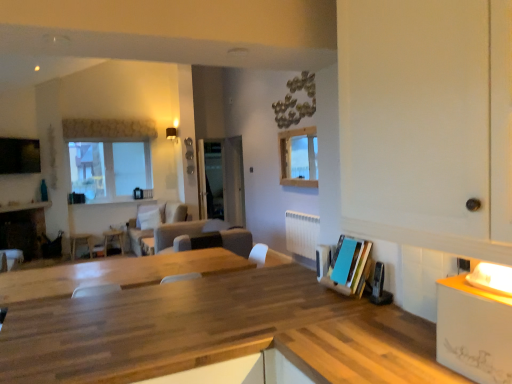
Question: Does suede beige couch at center, arranged as the second couch when viewed from the front, have a lesser height compared to suede-like gray couch at center, which appears as the second couch when viewed from the back?

Choices:
 (A) yes
 (B) no

Answer: (B)

Question: Is suede beige couch at center, the 1th couch from the back, in front of suede-like gray couch at center, arranged as the first couch when viewed from the front?

Choices:
 (A) yes
 (B) no

Answer: (B)

Question: Is suede beige couch at center, the 1th couch from the back, positioned with its back to suede-like gray couch at center, arranged as the first couch when viewed from the front?

Choices:
 (A) yes
 (B) no

Answer: (B)

Question: Can you see suede beige couch at center, arranged as the second couch when viewed from the front, touching suede-like gray couch at center, which appears as the second couch when viewed from the back?

Choices:
 (A) yes
 (B) no

Answer: (B)

Question: Considering the relative sizes of suede beige couch at center, the 1th couch from the back, and suede-like gray couch at center, arranged as the first couch when viewed from the front, in the image provided, is suede beige couch at center, the 1th couch from the back, wider than suede-like gray couch at center, arranged as the first couch when viewed from the front,?

Choices:
 (A) no
 (B) yes

Answer: (A)

Question: Is transparent glass door at center taller or shorter than white glossy counter at right?

Choices:
 (A) tall
 (B) short

Answer: (A)

Question: Based on their positions, is transparent glass door at center located to the left or right of white glossy counter at right?

Choices:
 (A) left
 (B) right

Answer: (A)

Question: In the image, is transparent glass door at center positioned in front of or behind white glossy counter at right?

Choices:
 (A) behind
 (B) front

Answer: (A)

Question: Would you say transparent glass door at center is inside or outside white glossy counter at right?

Choices:
 (A) inside
 (B) outside

Answer: (B)

Question: Is clear glass window at upper center, the second window from the back, bigger or smaller than suede-like gray couch at center, arranged as the first couch when viewed from the front?

Choices:
 (A) small
 (B) big

Answer: (A)

Question: Does point (282, 145) appear closer or farther from the camera than point (192, 221)?

Choices:
 (A) closer
 (B) farther

Answer: (A)

Question: From the image's perspective, is clear glass window at upper center, the second window from the back, located above or below suede-like gray couch at center, arranged as the first couch when viewed from the front?

Choices:
 (A) above
 (B) below

Answer: (A)

Question: From a real-world perspective, is clear glass window at upper center, which ranks as the first window in right-to-left order, physically located above or below suede-like gray couch at center, which appears as the second couch when viewed from the back?

Choices:
 (A) above
 (B) below

Answer: (A)

Question: Is suede-like gray couch at center, arranged as the first couch when viewed from the front, wider or thinner than matte black fireplace at left?

Choices:
 (A) thin
 (B) wide

Answer: (B)

Question: From a real-world perspective, is suede-like gray couch at center, which appears as the second couch when viewed from the back, positioned above or below matte black fireplace at left?

Choices:
 (A) below
 (B) above

Answer: (B)